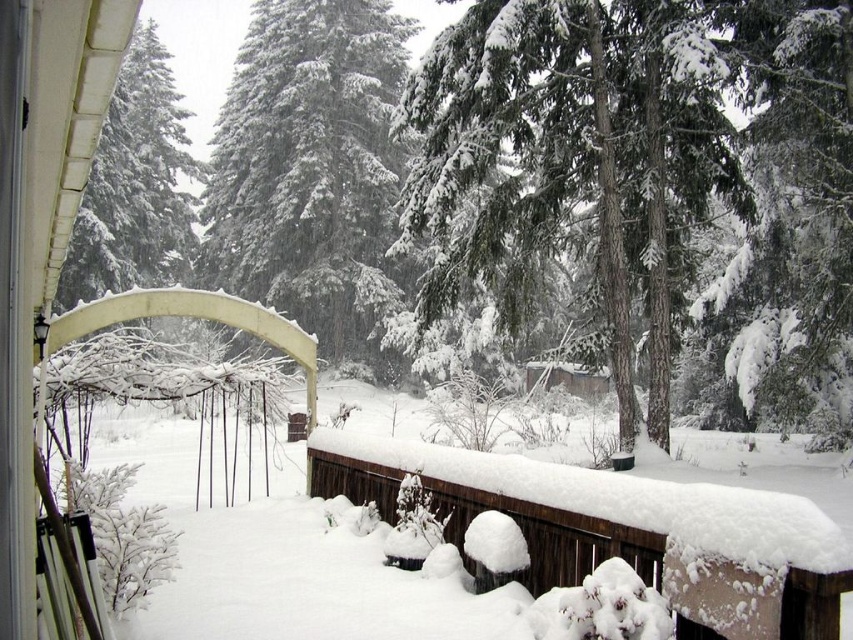
Who is higher up, green textured evergreen tree at center or white snow-covered tree at upper left?

Positioned higher is white snow-covered tree at upper left.

Looking at this image, between green textured evergreen tree at center and white snow-covered tree at upper left, which one has more height?

white snow-covered tree at upper left

Locate an element on the screen. This screenshot has height=640, width=853. green textured evergreen tree at center is located at coordinates (572, 154).

Is snow-covered wooden deck at center behind white snow-covered tree at upper left?

No, it is not.

Is point (822, 541) behind point (129, 116)?

No, it is in front of (129, 116).

Is point (839, 541) in front of point (143, 244)?

Yes, point (839, 541) is in front of point (143, 244).

Identify the location of snow-covered wooden deck at center. (622, 529).

Is point (454, 150) behind point (518, 481)?

That is True.

Does green textured evergreen tree at center appear under snow-covered wooden deck at center?

No, green textured evergreen tree at center is not below snow-covered wooden deck at center.

What do you see at coordinates (572, 154) in the screenshot? I see `green textured evergreen tree at center` at bounding box center [572, 154].

Find the location of a particular element. green textured evergreen tree at center is located at coordinates (572, 154).